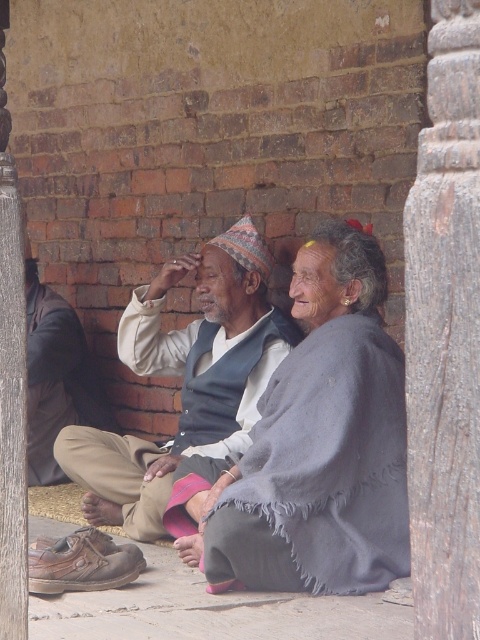
You are standing in front of the image and want to place a small decoration exactly at the position of the gray woolen shawl at center. According to the coordinates provided, where should you place it?

The gray woolen shawl at center is located at point (323,444), so you should place the decoration at those coordinates.

You are a photographer trying to capture a portrait of the gray woolen shawl at center and the light brown fabric hat at center. To ensure both are in frame, you need to know their positions relative to each other. Which object is positioned to the right side of the other?

The gray woolen shawl at center is to the right of the light brown fabric hat at center.

You are standing in front of the image and want to locate the light brown fabric hat at center. Which object in the scene is positioned at the coordinates point (186,380)?

The light brown fabric hat at center is positioned at the coordinates point (186,380).